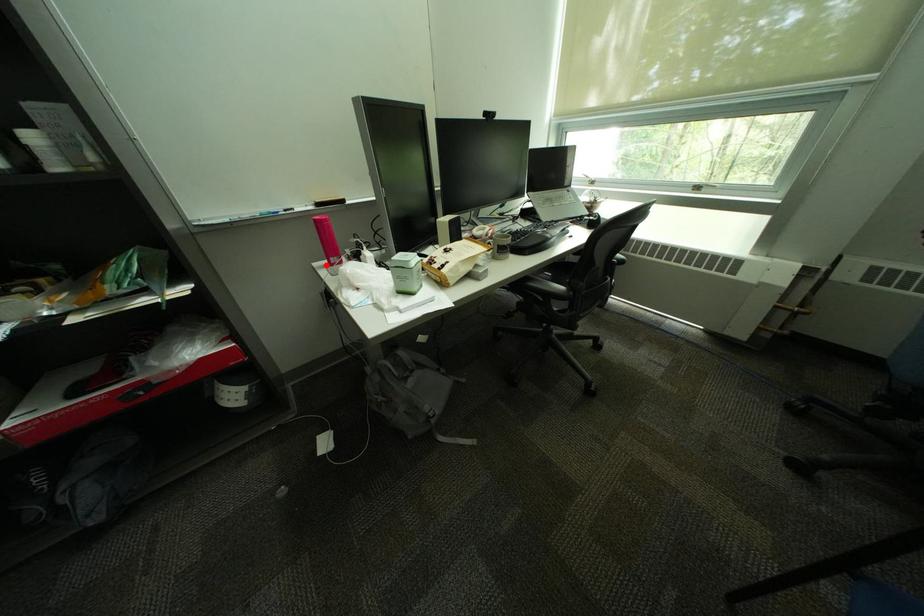
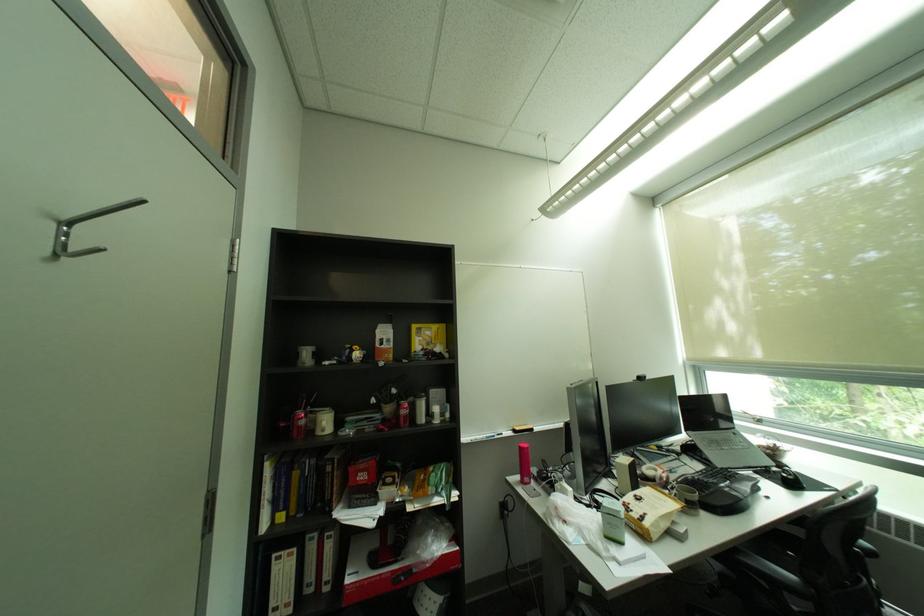
Question: I am providing you with two images of the same scene from different viewpoints. Given a red point in image1, look at the same physical point in image2. Is it:

Choices:
 (A) Closer to the viewpoint
 (B) Farther from the viewpoint

Answer: (B)